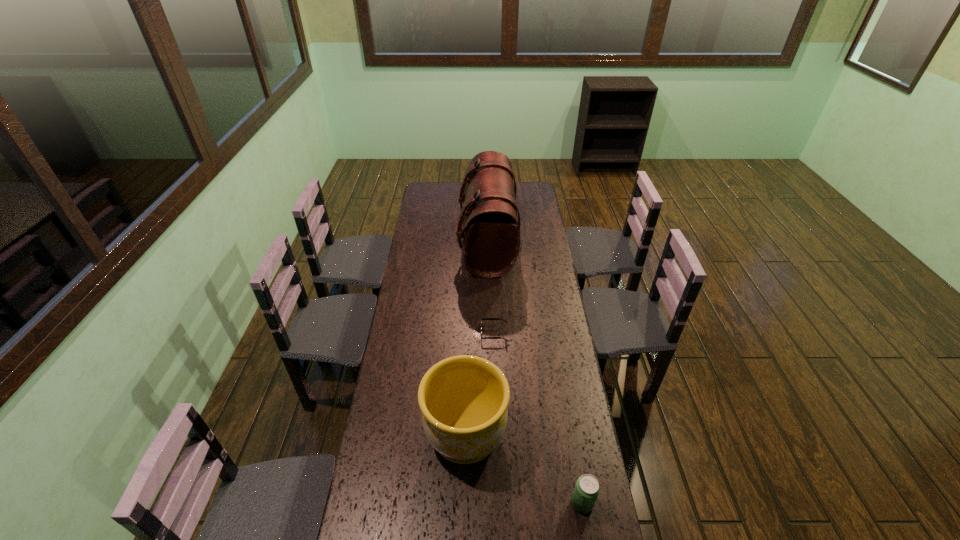
This screenshot has width=960, height=540. Identify the location of object that stands as the closest to the rightmost object. (463, 399).

At what (x,y) coordinates should I click in order to perform the action: click on vacant area in the image that satisfies the following two spatial constraints: 1. on the front side of the flowerpot; 2. on the left side of the soda. Please return your answer as a coordinate pair (x, y). Looking at the image, I should click on (464, 503).

Identify the location of free point that satisfies the following two spatial constraints: 1. on the front-facing side of the tallest object; 2. on the left side of the third tallest object. The image size is (960, 540). (492, 503).

Identify the location of vacant space that satisfies the following two spatial constraints: 1. on the back side of the soda; 2. on the front-facing side of the farthest object. (539, 244).

I want to click on vacant area in the image that satisfies the following two spatial constraints: 1. on the back side of the second shortest object; 2. on the front-facing side of the farthest object, so click(x=539, y=244).

This screenshot has height=540, width=960. What are the coordinates of `vacant area that satisfies the following two spatial constraints: 1. on the front-facing side of the third tallest object; 2. on the right side of the tallest object` in the screenshot? It's located at (492, 503).

This screenshot has width=960, height=540. I want to click on vacant space that satisfies the following two spatial constraints: 1. on the front-facing side of the tallest object; 2. on the front side of the second nearest object, so click(491, 435).